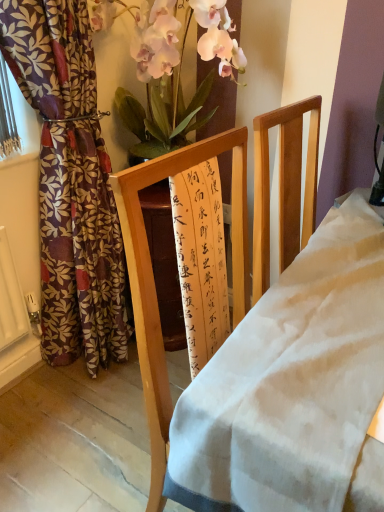
Question: Is wooden frame at center facing away from floral-patterned fabric curtain at left?

Choices:
 (A) yes
 (B) no

Answer: (A)

Question: Is wooden frame at center not near floral-patterned fabric curtain at left?

Choices:
 (A) no
 (B) yes

Answer: (B)

Question: Does wooden frame at center touch floral-patterned fabric curtain at left?

Choices:
 (A) no
 (B) yes

Answer: (A)

Question: From the image's perspective, would you say wooden frame at center is shown under floral-patterned fabric curtain at left?

Choices:
 (A) no
 (B) yes

Answer: (B)

Question: From a real-world perspective, is wooden frame at center physically below floral-patterned fabric curtain at left?

Choices:
 (A) no
 (B) yes

Answer: (B)

Question: Considering the relative sizes of wooden frame at center and floral-patterned fabric curtain at left in the image provided, is wooden frame at center bigger than floral-patterned fabric curtain at left?

Choices:
 (A) no
 (B) yes

Answer: (B)

Question: Considering the relative sizes of silky pink petals at upper center and wooden frame at center in the image provided, is silky pink petals at upper center shorter than wooden frame at center?

Choices:
 (A) yes
 (B) no

Answer: (A)

Question: Is silky pink petals at upper center turned away from wooden frame at center?

Choices:
 (A) yes
 (B) no

Answer: (B)

Question: Can you confirm if silky pink petals at upper center is positioned to the right of wooden frame at center?

Choices:
 (A) yes
 (B) no

Answer: (B)

Question: Does silky pink petals at upper center have a larger size compared to wooden frame at center?

Choices:
 (A) no
 (B) yes

Answer: (A)

Question: Does silky pink petals at upper center have a lesser width compared to wooden frame at center?

Choices:
 (A) yes
 (B) no

Answer: (B)

Question: Is silky pink petals at upper center further to the viewer compared to wooden frame at center?

Choices:
 (A) no
 (B) yes

Answer: (B)

Question: Is silky pink petals at upper center at the back of floral-patterned fabric curtain at left?

Choices:
 (A) no
 (B) yes

Answer: (A)